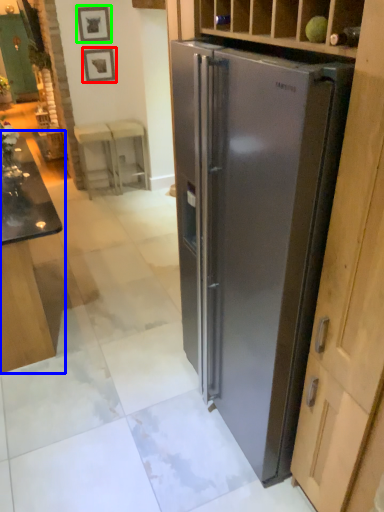
Question: Based on their relative distances, which object is farther from picture frame (highlighted by a red box)? Choose from table (highlighted by a blue box) and picture frame (highlighted by a green box).

Choices:
 (A) table
 (B) picture frame

Answer: (A)